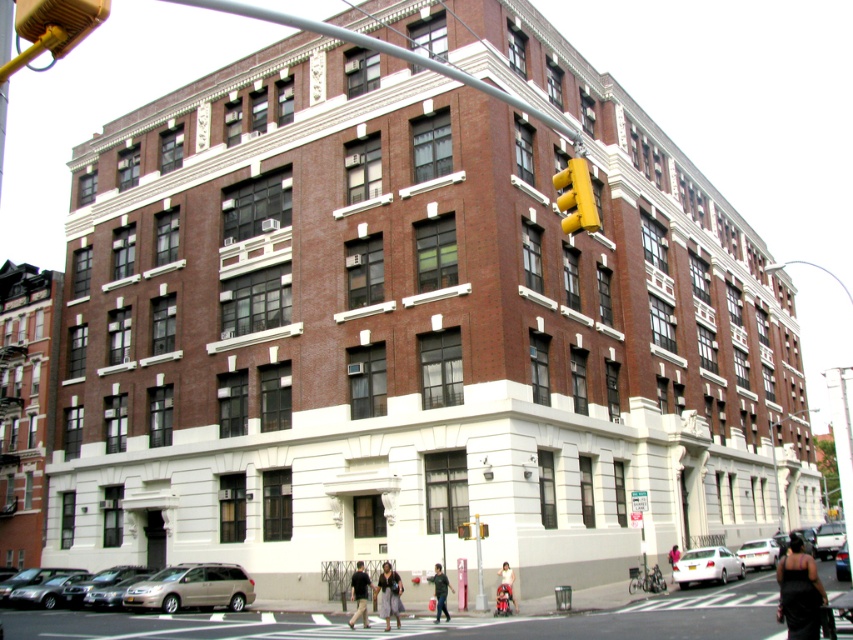
Does yellow matte traffic light at upper center appear under yellow plastic traffic light at upper center?

Actually, yellow matte traffic light at upper center is above yellow plastic traffic light at upper center.

Can you confirm if yellow matte traffic light at upper center is positioned above yellow plastic traffic light at upper center?

Correct, yellow matte traffic light at upper center is located above yellow plastic traffic light at upper center.

Does point (577, 198) come farther from viewer compared to point (483, 536)?

No, (577, 198) is closer to viewer.

What are the coordinates of `yellow matte traffic light at upper center` in the screenshot? It's located at (576, 196).

Which is more to the left, yellow matte traffic light at upper center or white matte car at lower right?

yellow matte traffic light at upper center

Measure the distance from yellow matte traffic light at upper center to white matte car at lower right.

yellow matte traffic light at upper center is 25.03 meters from white matte car at lower right.

Where is `yellow matte traffic light at upper center`? The image size is (853, 640). yellow matte traffic light at upper center is located at coordinates (576, 196).

Based on the photo, which of these two, metallic silver minivan at lower center or white plastic street sign at upper center, stands taller?

metallic silver minivan at lower center is taller.

Can you confirm if metallic silver minivan at lower center is bigger than white plastic street sign at upper center?

Yes, metallic silver minivan at lower center is bigger than white plastic street sign at upper center.

You are a GUI agent. You are given a task and a screenshot of the screen. Output one action in this format:
    pyautogui.click(x=<x>, y=<y>)
    Task: Click on the metallic silver minivan at lower center
    This screenshot has height=640, width=853.
    Given the screenshot: What is the action you would take?
    pyautogui.click(x=192, y=588)